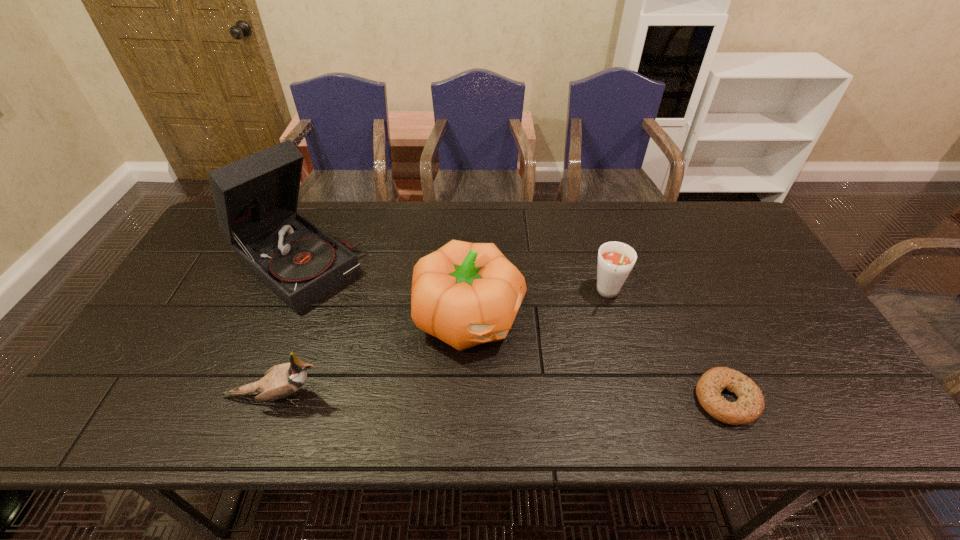
Locate an element on the screen. This screenshot has width=960, height=540. bird is located at coordinates (280, 381).

The height and width of the screenshot is (540, 960). I want to click on the shortest object, so click(x=750, y=404).

This screenshot has height=540, width=960. Identify the location of bagel. (750, 404).

The image size is (960, 540). I want to click on the third object from left to right, so click(465, 294).

The width and height of the screenshot is (960, 540). In order to click on the fourth shortest object in this screenshot , I will do `click(465, 294)`.

What are the coordinates of `the tallest object` in the screenshot? It's located at (255, 198).

Find the location of a particular element. This screenshot has width=960, height=540. root beer is located at coordinates (615, 261).

I want to click on vacant region located at the face of the bird, so click(428, 396).

Identify the location of free space located 0.150m on the back of the bagel. (693, 324).

Find the location of a particular element. This screenshot has width=960, height=540. vacant space located on the carved face of the second tallest object is located at coordinates (530, 368).